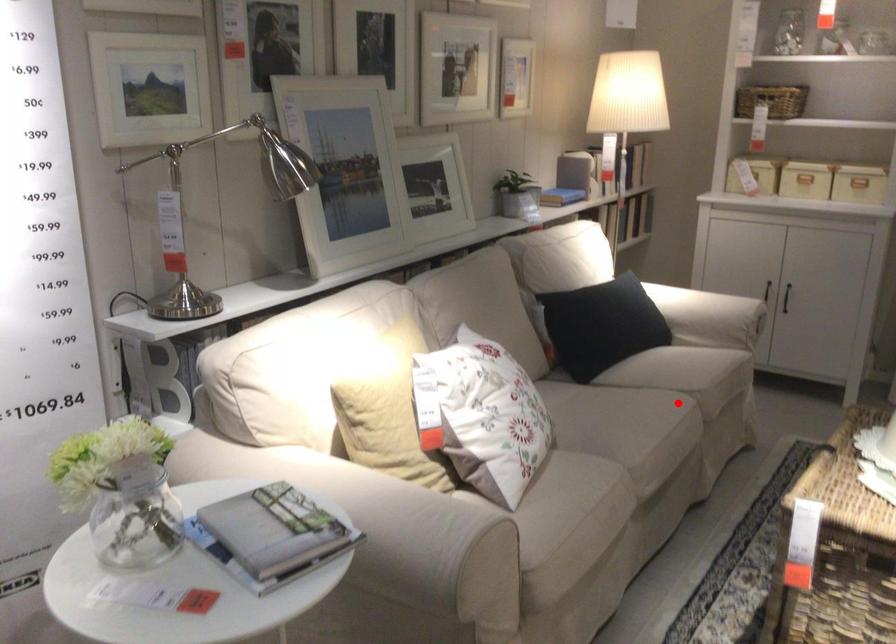
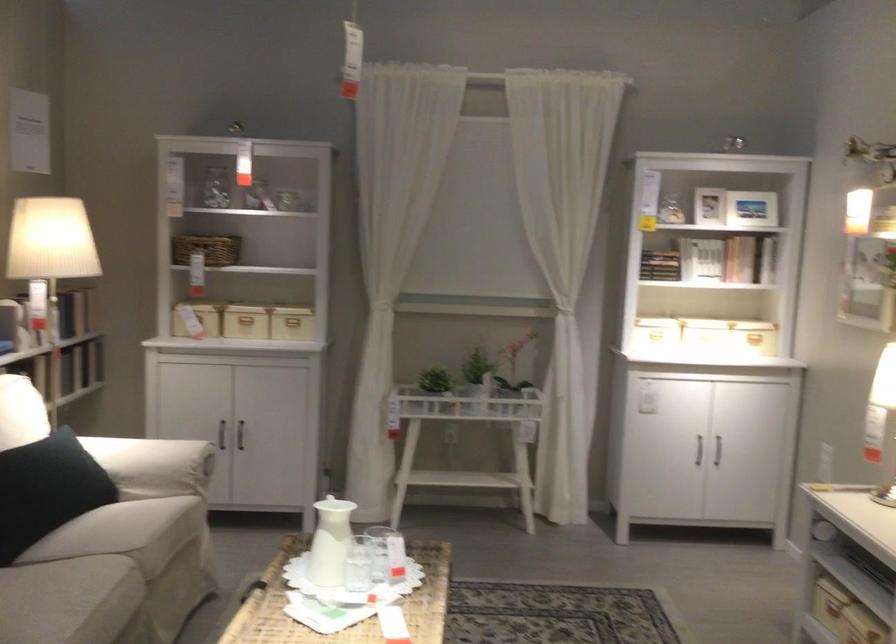
Where in the second image is the point corresponding to the highlighted location from the first image?

(110, 576)